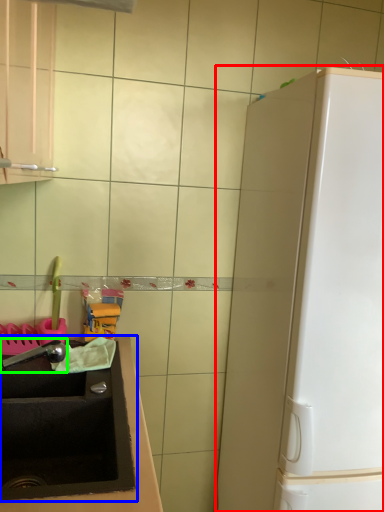
Question: Which is nearer to the appliance (highlighted by a red box)? sink (highlighted by a blue box) or faucet (highlighted by a green box).

Choices:
 (A) sink
 (B) faucet

Answer: (A)